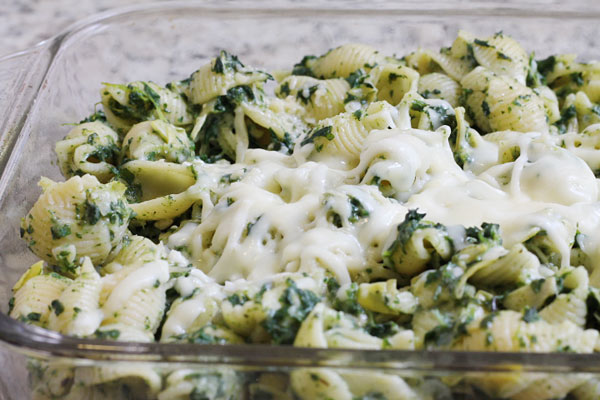
This screenshot has height=400, width=600. What are the coordinates of `dish` in the screenshot? It's located at 26,99.